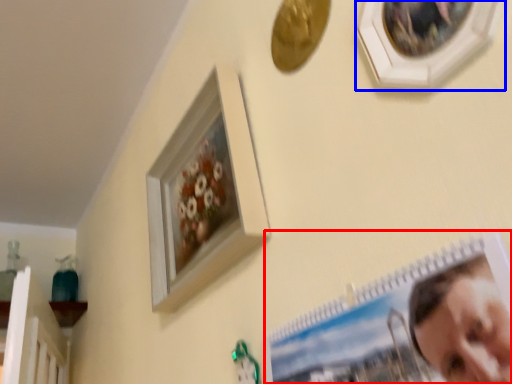
Question: Which object is further to the camera taking this photo, picture frame (highlighted by a red box) or picture frame (highlighted by a blue box)?

Choices:
 (A) picture frame
 (B) picture frame

Answer: (B)